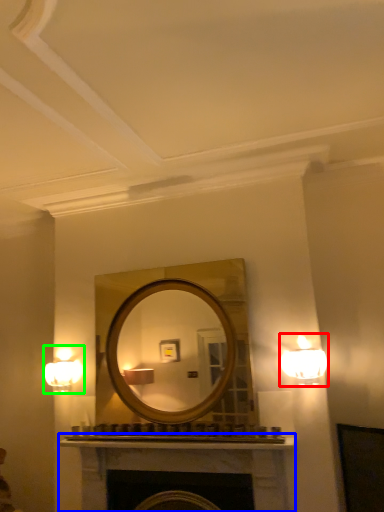
Question: Which object is positioned closest to lamp (highlighted by a red box)? Select from fireplace (highlighted by a blue box) and fixture (highlighted by a green box).

Choices:
 (A) fireplace
 (B) fixture

Answer: (A)